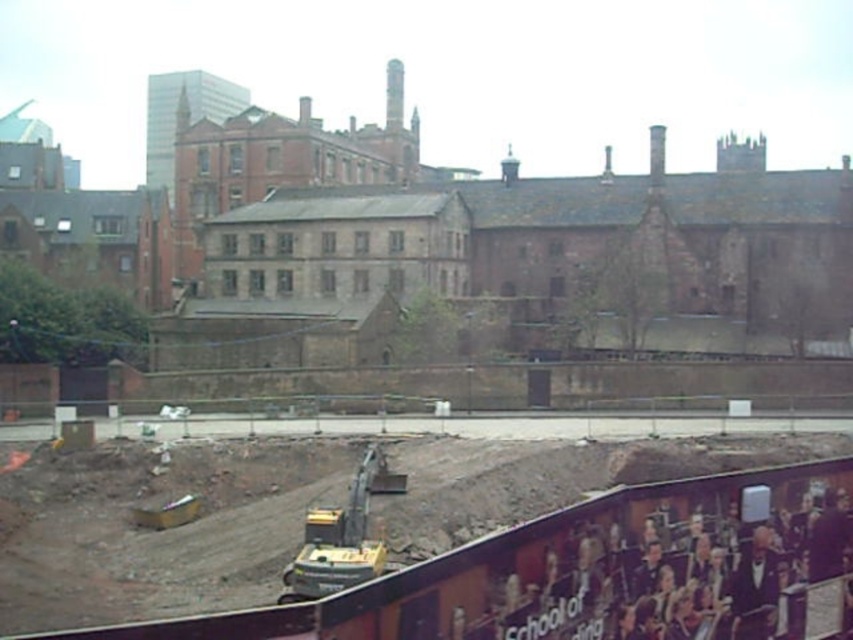
In the scene shown: You are a delivery driver approaching the construction site and need to navigate to the historic building. The brown dirt track at lower center is your only path. Can you safely drive over it?

The brown dirt track at lower center is located at point (596, 566), which means it is positioned in the lower center area of the image. Since it is the only path available to reach the historic building, you can safely drive over it despite the construction site conditions.

You are a delivery driver who needs to drive a truck with a height of 2 meters through the brown dirt track at lower center and the yellow metallic excavator at center. Based on the scene description, will your truck be able to pass under both objects without hitting them?

The brown dirt track at lower center has a greater height compared to the yellow metallic excavator at center. Since the excavator is shorter, the truck might hit the dirt track if it is too high. However, the exact height isnecessary to determine clearance. Without specific measurements, it is uncertain if the truck can pass safely.

You are a construction worker standing at the point marked as point (x=596, y=566). You need to walk to the yellow excavator. Is the path clear? Please explain.

The path to the yellow excavator is clear because the brown dirt track at lower center at point (x=596, y=566) is the path leading to the excavator, and there are no obstacles mentioned in the scene description.